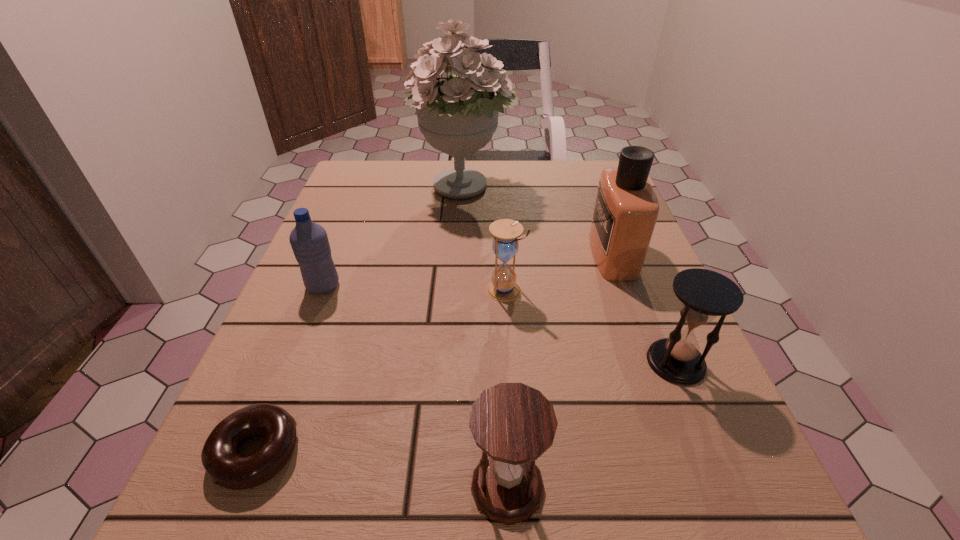
The width and height of the screenshot is (960, 540). In order to click on vacant space at the far left corner of the desktop in this screenshot , I will do `click(373, 179)`.

Locate an element on the screen. Image resolution: width=960 pixels, height=540 pixels. vacant region at the near left corner of the desktop is located at coordinates (305, 510).

Where is `free space at the far right corner of the desktop`? free space at the far right corner of the desktop is located at coordinates (564, 167).

The image size is (960, 540). Identify the location of free location at the near right corner. (686, 498).

The width and height of the screenshot is (960, 540). In order to click on free spot between the doughnut and the water bottle in this screenshot , I will do (x=289, y=369).

This screenshot has width=960, height=540. I want to click on empty space between the bouquet and the third nearest object, so click(570, 275).

Identify the location of empty space between the doughnut and the nearest hourglass. Image resolution: width=960 pixels, height=540 pixels. (381, 469).

The height and width of the screenshot is (540, 960). Find the location of `vacant area between the doughnut and the second farthest hourglass`. vacant area between the doughnut and the second farthest hourglass is located at coordinates (466, 407).

Locate an element on the screen. The image size is (960, 540). unoccupied position between the nearest hourglass and the second farthest hourglass is located at coordinates pos(591,424).

Find the location of a particular element. Image resolution: width=960 pixels, height=540 pixels. vacant area that lies between the tallest object and the rightmost hourglass is located at coordinates (570, 275).